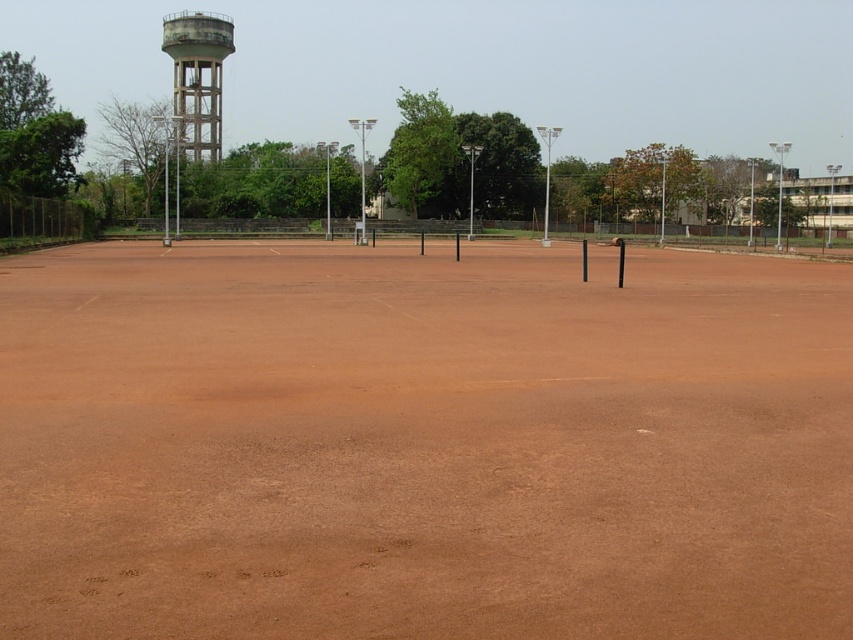
Can you confirm if brown clay court at center is smaller than concrete water tower at upper left?

Indeed, brown clay court at center has a smaller size compared to concrete water tower at upper left.

From the picture: Does brown clay court at center have a greater height compared to concrete water tower at upper left?

In fact, brown clay court at center may be shorter than concrete water tower at upper left.

The height and width of the screenshot is (640, 853). Describe the element at coordinates (422, 444) in the screenshot. I see `brown clay court at center` at that location.

At what (x,y) coordinates should I click in order to perform the action: click on brown clay court at center. Please return your answer as a coordinate pair (x, y). Image resolution: width=853 pixels, height=640 pixels. Looking at the image, I should click on (422, 444).